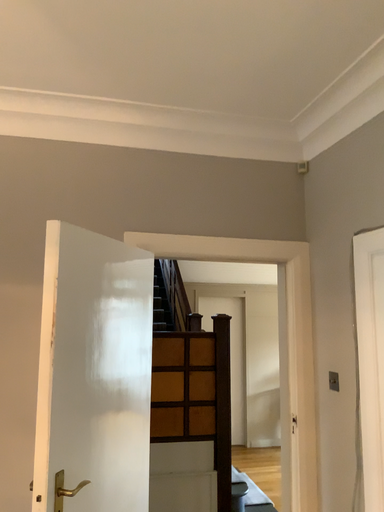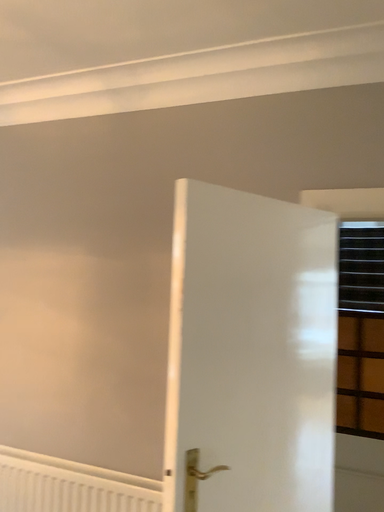
Question: How did the camera likely rotate when shooting the video?

Choices:
 (A) rotated left
 (B) rotated right

Answer: (A)